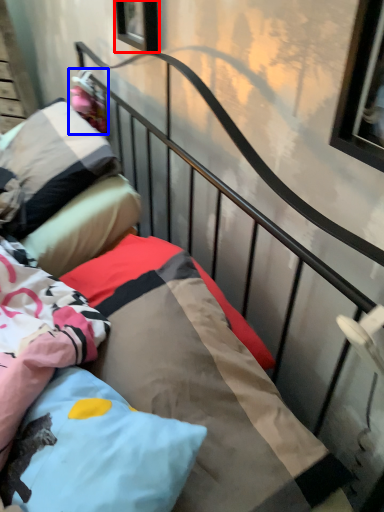
Question: Which object appears closest to the camera in this image, window (highlighted by a red box) or doll (highlighted by a blue box)?

Choices:
 (A) window
 (B) doll

Answer: (A)